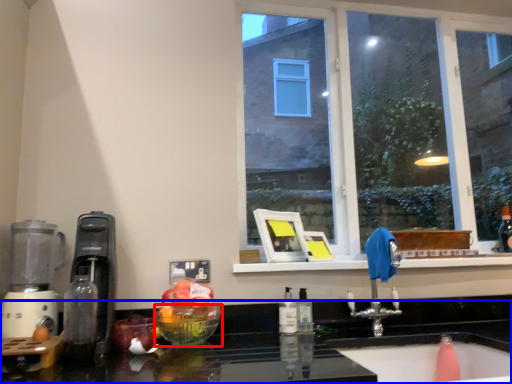
Question: Which object is further to the camera taking this photo, glass bowl (highlighted by a red box) or countertop (highlighted by a blue box)?

Choices:
 (A) glass bowl
 (B) countertop

Answer: (A)